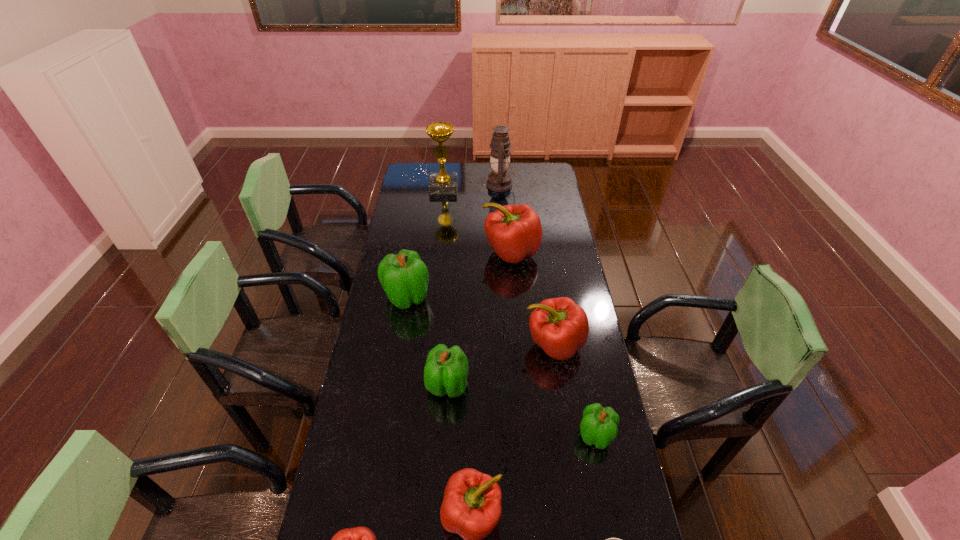
Identify the location of blank region between the third smallest pink bell pepper and the gold award. tap(499, 266).

The width and height of the screenshot is (960, 540). In order to click on free point between the seventh nearest object and the biggest pink bell pepper in this screenshot , I will do `click(459, 274)`.

Identify the location of the sixth closest object relative to the third biggest pink bell pepper. (404, 277).

Identify the location of object that stands as the eighth closest to the can. This screenshot has width=960, height=540. (499, 180).

Select which bell pepper is the third closest to the third smallest pink bell pepper. Please provide its 2D coordinates. Your answer should be formatted as a tuple, i.e. [(x, y)], where the tuple contains the x and y coordinates of a point satisfying the conditions above.

[(514, 232)]

The width and height of the screenshot is (960, 540). Find the location of `the seventh closest bell pepper to the silver can`. the seventh closest bell pepper to the silver can is located at coordinates (514, 232).

Identify the location of pink bell pepper that is the third closest to the third biggest pink bell pepper. The image size is (960, 540). (514, 232).

This screenshot has height=540, width=960. I want to click on pink bell pepper object that ranks as the second closest to the second smallest pink bell pepper, so click(x=559, y=326).

You are a GUI agent. You are given a task and a screenshot of the screen. Output one action in this format:
    pyautogui.click(x=<x>, y=<y>)
    Task: Click on the green bell pepper that is the second closest to the blue oil lamp
    
    Given the screenshot: What is the action you would take?
    pyautogui.click(x=446, y=370)

Where is `the closest green bell pepper relative to the second biggest pink bell pepper`? the closest green bell pepper relative to the second biggest pink bell pepper is located at coordinates (598, 426).